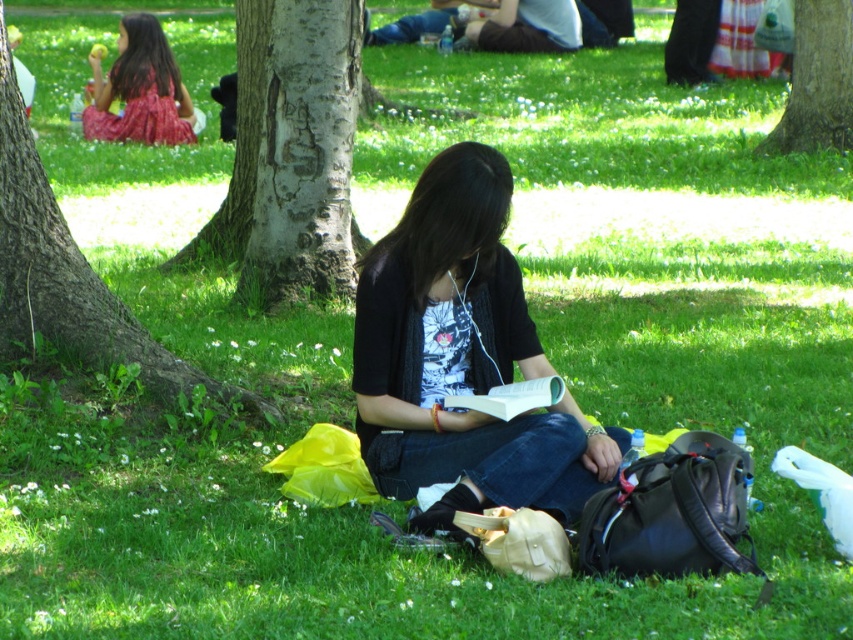
Question: Does smooth gray bark at center have a greater width compared to matte pink dress at upper left?

Choices:
 (A) no
 (B) yes

Answer: (A)

Question: Does smooth bark tree at upper right have a greater width compared to white paper book at center?

Choices:
 (A) no
 (B) yes

Answer: (B)

Question: Considering the relative positions of matte black shirt at center and white paper book at center in the image provided, where is matte black shirt at center located with respect to white paper book at center?

Choices:
 (A) above
 (B) below

Answer: (A)

Question: Based on their relative distances, which object is farther from the matte black shirt at center?

Choices:
 (A) smooth gray bark at lower left
 (B) matte pink dress at upper left
 (C) smooth gray bark at center

Answer: (B)

Question: Which point appears closest to the camera in this image?

Choices:
 (A) (479, 403)
 (B) (194, 140)
 (C) (440, 454)

Answer: (A)

Question: Which is farther from the smooth gray bark at center?

Choices:
 (A) smooth gray bark at lower left
 (B) matte pink dress at upper left
 (C) white paper book at center

Answer: (B)